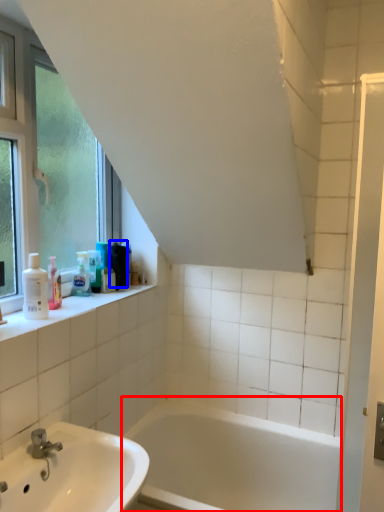
Question: Which object appears farthest to the camera in this image, bathtub (highlighted by a red box) or toiletry (highlighted by a blue box)?

Choices:
 (A) bathtub
 (B) toiletry

Answer: (B)